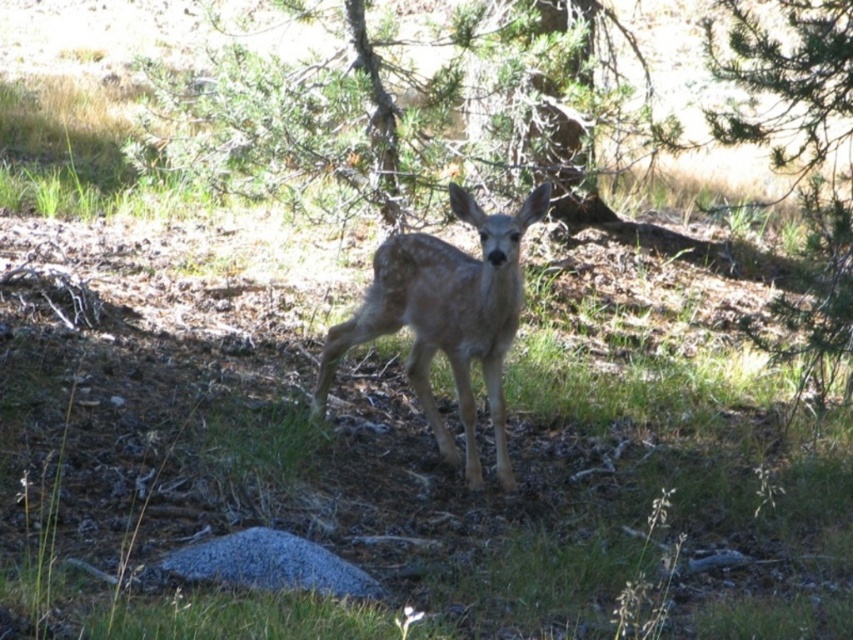
Question: Does green textured tree at upper center have a larger size compared to fawn fur at center?

Choices:
 (A) yes
 (B) no

Answer: (A)

Question: Can you confirm if green textured tree at upper center is wider than fawn fur at center?

Choices:
 (A) no
 (B) yes

Answer: (B)

Question: Which point is farther from the camera taking this photo?

Choices:
 (A) (569, 141)
 (B) (495, 332)

Answer: (A)

Question: Which object is closer to the camera taking this photo?

Choices:
 (A) fawn fur at center
 (B) green textured tree at upper center

Answer: (A)

Question: Does green textured tree at upper center have a greater width compared to fawn fur at center?

Choices:
 (A) yes
 (B) no

Answer: (A)

Question: Which point appears farthest from the camera in this image?

Choices:
 (A) (468, 19)
 (B) (347, 348)

Answer: (A)